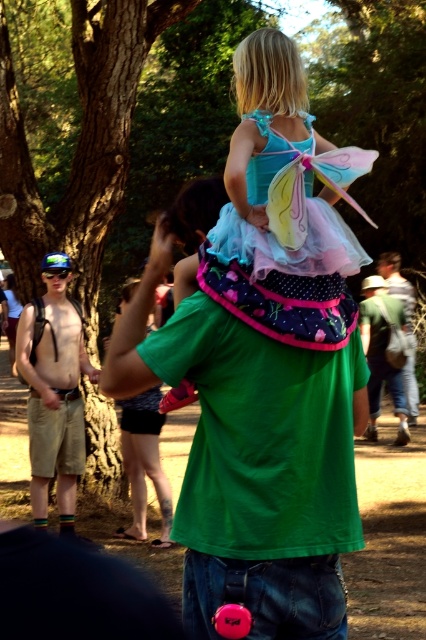
Which is in front, point (273, 156) or point (17, 314)?

Point (273, 156)

Does point (288, 268) lie behind point (14, 362)?

No, it is not.

This screenshot has width=426, height=640. In order to click on pastel tulle dress at upper center in this screenshot , I will do `click(284, 259)`.

Locate an element on the screen. Image resolution: width=426 pixels, height=640 pixels. pastel tulle dress at upper center is located at coordinates (284, 259).

Is matte blue tulle dress at center below denim jeans at lower right?

Correct, matte blue tulle dress at center is located below denim jeans at lower right.

Is matte blue tulle dress at center positioned at the back of denim jeans at lower right?

That is False.

Where is `matte blue tulle dress at center`? matte blue tulle dress at center is located at coordinates (259, 378).

Can you confirm if pink fabric dress at upper center is positioned below skinny jeans at lower center?

Indeed, pink fabric dress at upper center is positioned under skinny jeans at lower center.

Who is more distant from viewer, (155, 413) or (11, 280)?

The point (11, 280) is more distant.

Where is `pink fabric dress at upper center`? pink fabric dress at upper center is located at coordinates (143, 464).